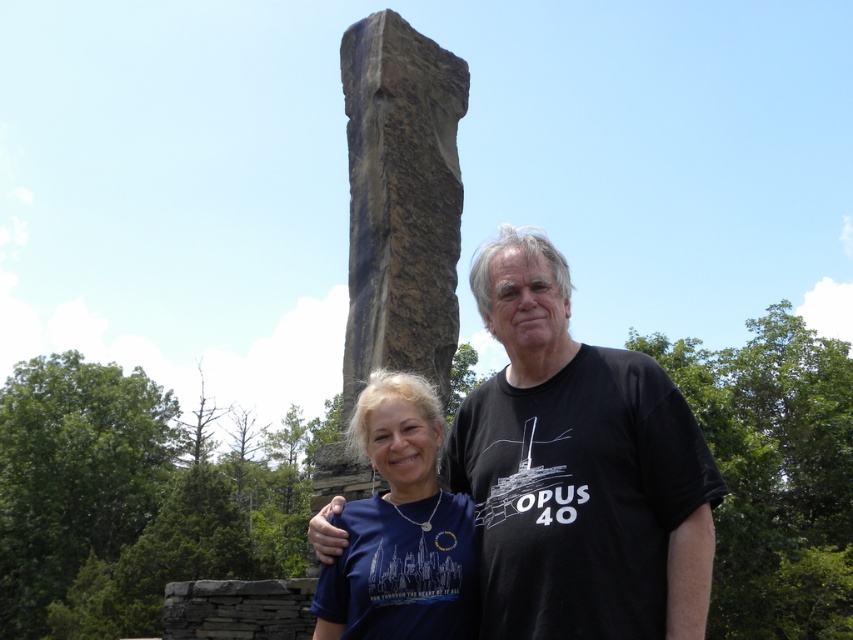
Who is positioned more to the left, black cotton t-shirt at center or matte blue t-shirt at center?

Positioned to the left is matte blue t-shirt at center.

Is black cotton t-shirt at center to the left of matte blue t-shirt at center from the viewer's perspective?

Incorrect, black cotton t-shirt at center is not on the left side of matte blue t-shirt at center.

You are a GUI agent. You are given a task and a screenshot of the screen. Output one action in this format:
    pyautogui.click(x=<x>, y=<y>)
    Task: Click on the black cotton t-shirt at center
    Image resolution: width=853 pixels, height=640 pixels.
    Given the screenshot: What is the action you would take?
    click(x=578, y=468)

Between black cotton t-shirt at center and dark brown stone column at center, which one has more height?

Standing taller between the two is dark brown stone column at center.

Who is shorter, black cotton t-shirt at center or dark brown stone column at center?

Standing shorter between the two is black cotton t-shirt at center.

Identify the location of black cotton t-shirt at center. (578, 468).

Which is in front, point (366, 364) or point (438, 516)?

Point (438, 516)

Is point (463, 65) positioned behind point (422, 516)?

Yes.

In order to click on dark brown stone column at center in this screenshot , I will do `click(399, 202)`.